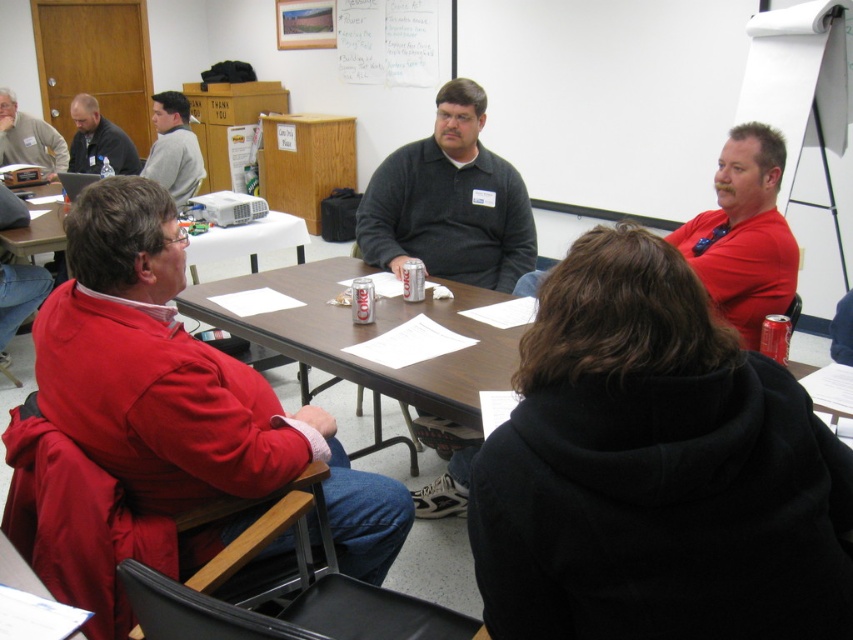
Question: Which point is farther to the camera?

Choices:
 (A) (136, 163)
 (B) (581, 504)

Answer: (A)

Question: Is red matte jacket at left in front of brown wood table at center?

Choices:
 (A) no
 (B) yes

Answer: (B)

Question: Which point is farther to the camera?

Choices:
 (A) (399, 266)
 (B) (173, 99)
 (C) (486, 291)
 (D) (483, 547)

Answer: (B)

Question: Which point is closer to the camera?

Choices:
 (A) (309, 396)
 (B) (721, 621)
 (C) (68, 106)
 (D) (491, 204)

Answer: (B)

Question: Is brown wood table at center below matte gray shirt at upper left?

Choices:
 (A) yes
 (B) no

Answer: (A)

Question: Can you confirm if red matte jacket at left is positioned above red matte shirt at right?

Choices:
 (A) no
 (B) yes

Answer: (A)